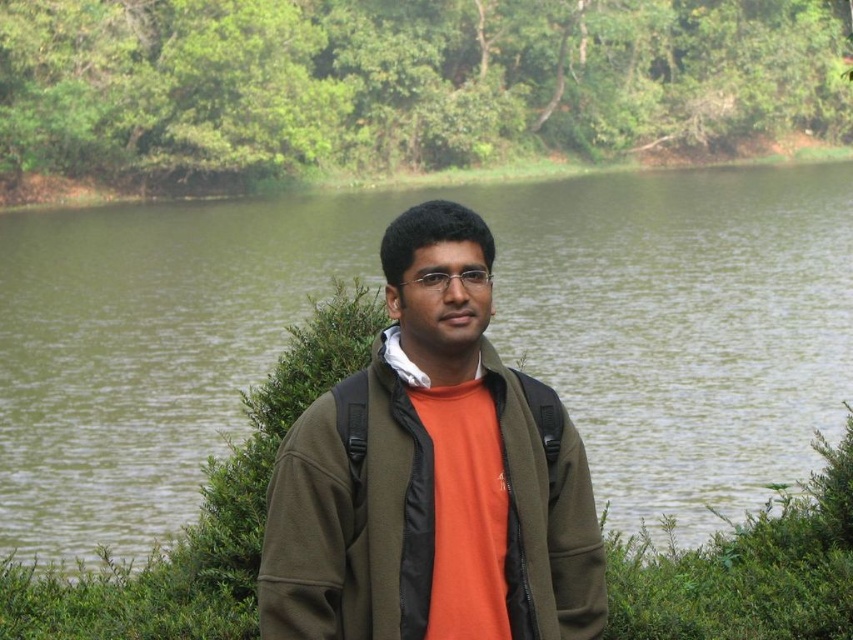
You are a hiker who wants to cross the green water at center. The matte green jacket at center is your backpack. Can you safely cross the water if the jacket can only stay afloat if it is submerged less than its height?

The green water at center is taller than the matte green jacket at center. Since the jacket can only stay afloat if submerged less than its height, the water is deeper than the jacket, so it won

You are a hiker who needs to cross the green water at center. You have a 45 meter long rope. The matte green jacket at center is your starting point. Can you safely cross the water with the rope?

The green water at center is 44.05 meters from the matte green jacket at center. Since the rope is 45 meters long, it is just enough to safely cross the water.

You are navigating a small boat on the lake and need to reach a point directly in front of you. Based on the coordinates provided, is the green water at center directly ahead of your current position?

The green water at center is located at point coordinates, so yes, it is directly ahead of your current position.